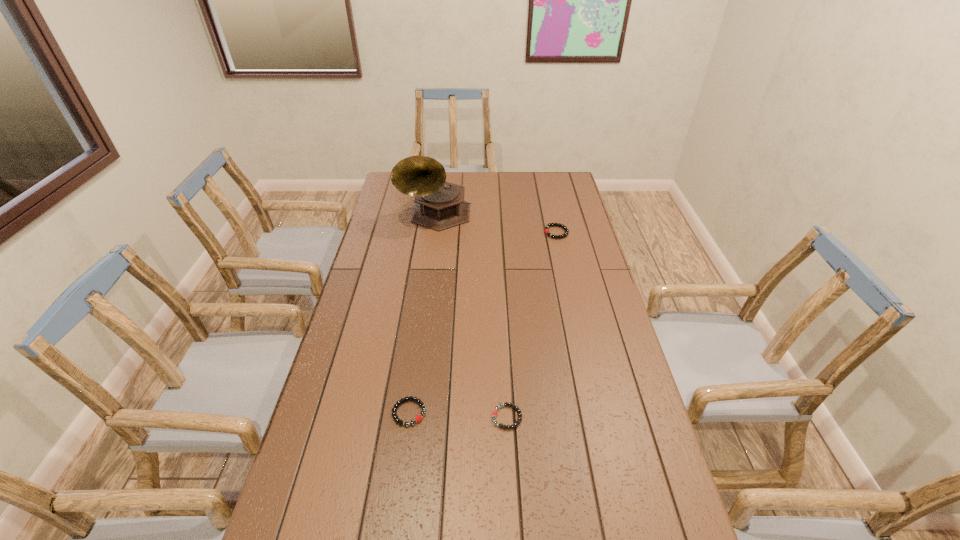
The width and height of the screenshot is (960, 540). Find the location of `the tallest object`. the tallest object is located at coordinates (439, 205).

Locate an element on the screen. This screenshot has height=540, width=960. the rightmost object is located at coordinates (548, 225).

At what (x,y) coordinates should I click in order to perform the action: click on the rightmost bracelet. Please return your answer as a coordinate pair (x, y). Looking at the image, I should click on (548, 225).

This screenshot has height=540, width=960. Identify the location of the leftmost bracelet. 418,418.

Find the location of a particular element. the second object from right to left is located at coordinates (494, 413).

What are the coordinates of `free point located 0.390m on the horn direction of the tallest object` in the screenshot? It's located at (424, 304).

I want to click on free location located on the back of the farthest bracelet, so tap(552, 212).

Identify the location of vacant point located on the left of the leftmost bracelet. The image size is (960, 540). (340, 413).

Identify the location of free space located on the right of the second bracelet from right to left. This screenshot has width=960, height=540. (645, 417).

This screenshot has width=960, height=540. I want to click on object that is at the far edge, so click(439, 205).